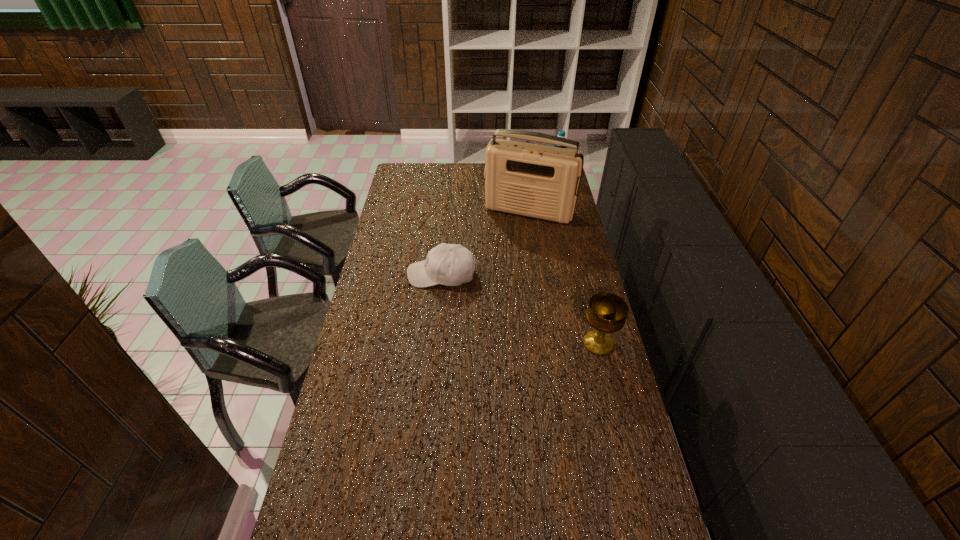
The image size is (960, 540). Find the location of `free space located on the front-facing side of the leftmost object`. free space located on the front-facing side of the leftmost object is located at coordinates (381, 274).

Identify the location of free space located on the back of the nearest object. (585, 288).

Where is `vacant space situated 0.390m on the front-facing side of the tallest object`? The image size is (960, 540). vacant space situated 0.390m on the front-facing side of the tallest object is located at coordinates (493, 280).

At what (x,y) coordinates should I click in order to perform the action: click on blank area located 0.130m on the front-facing side of the tallest object. Please return your answer as a coordinate pair (x, y). The height and width of the screenshot is (540, 960). Looking at the image, I should click on (510, 242).

Where is `vacant space situated 0.370m on the front-facing side of the tallest object`? vacant space situated 0.370m on the front-facing side of the tallest object is located at coordinates (494, 276).

Identify the location of vacant area located on the label of the farthest object. (549, 211).

At what (x,y) coordinates should I click in order to perform the action: click on free space located 0.280m on the label of the farthest object. Please return your answer as a coordinate pair (x, y). Looking at the image, I should click on (549, 208).

Locate an element on the screen. free space located on the label of the farthest object is located at coordinates (554, 185).

Identify the location of object present at the far edge. (561, 133).

At what (x,y) coordinates should I click in order to perform the action: click on object that is at the left edge. Please return your answer as a coordinate pair (x, y). This screenshot has height=540, width=960. Looking at the image, I should click on (448, 264).